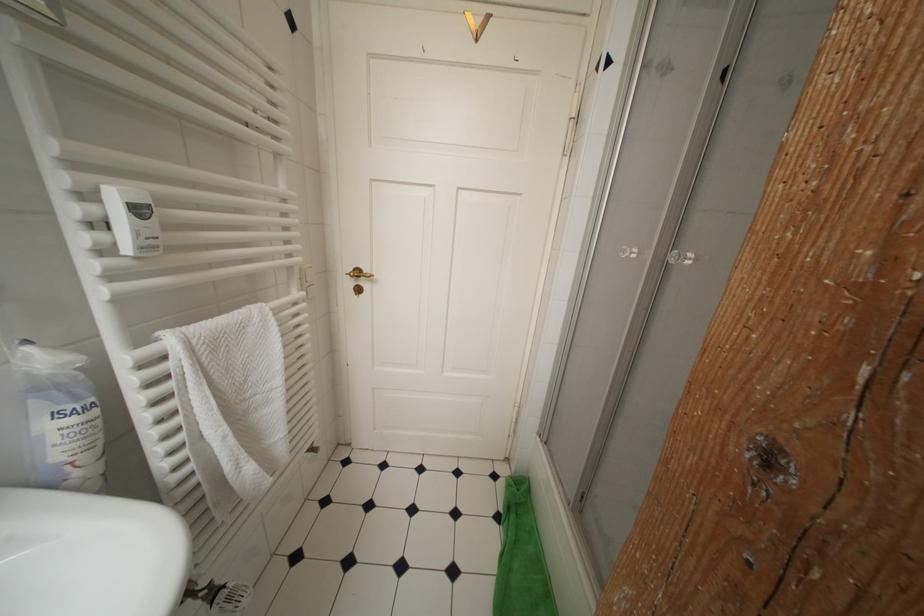
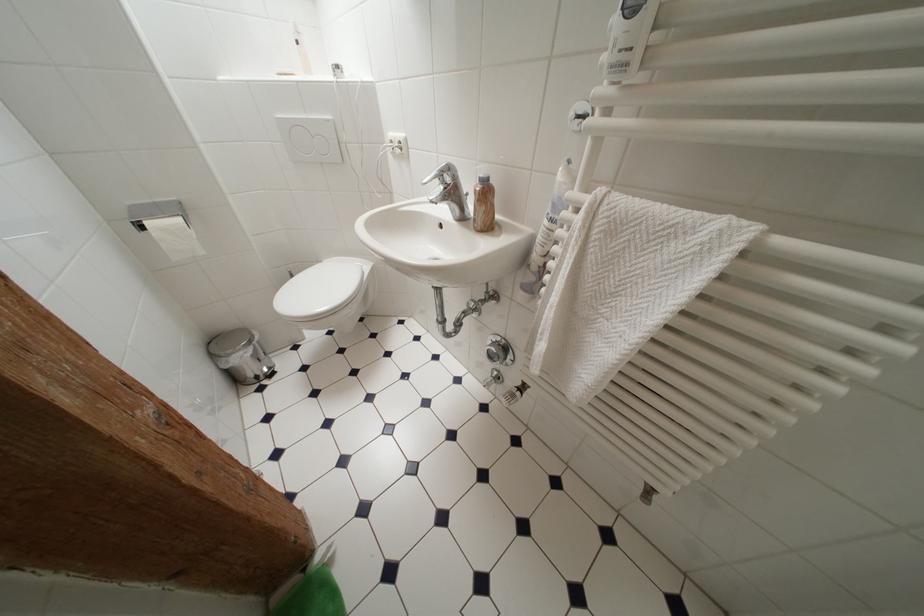
In the second image, find the point that corresponds to point 244,450 in the first image.

(555, 325)